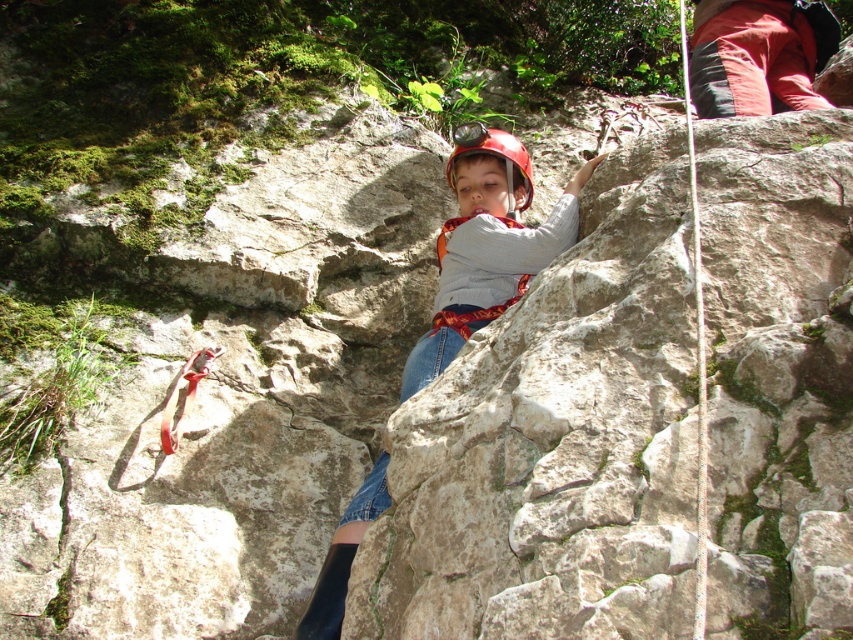
You are a photographer trying to capture the climber from the front. You notice the matte gray helmet at center and the white nylon rope at right. Which object should you focus on first to ensure it appears sharp in the photo?

The matte gray helmet at center is further to the viewer than the white nylon rope at right, so you should focus on the matte gray helmet at center first to ensure it appears sharp.

You are a photographer trying to capture the climber in the image. You notice two points marked on the rock face at coordinates point (437, 330) and point (456, 147). Which point should you focus on to ensure it appears larger in your photo?

Point (437, 330) should be focused on because it is closer to the camera than point (456, 147), making it appear larger in the photo.

Consider the image. You are a safety inspector checking the rock climbing setup. You notice the matte gray helmet at center and the white nylon rope at right. According to safety protocols, the helmet should be positioned above the rope to ensure it doesn not interfere with head movement. Is the current arrangement compliant with safety standards?

The matte gray helmet at center is located below the white nylon rope at right, which violates safety protocols since the helmet should be positioned above the rope to allow for free head movement. The setup is not compliant with safety standards.